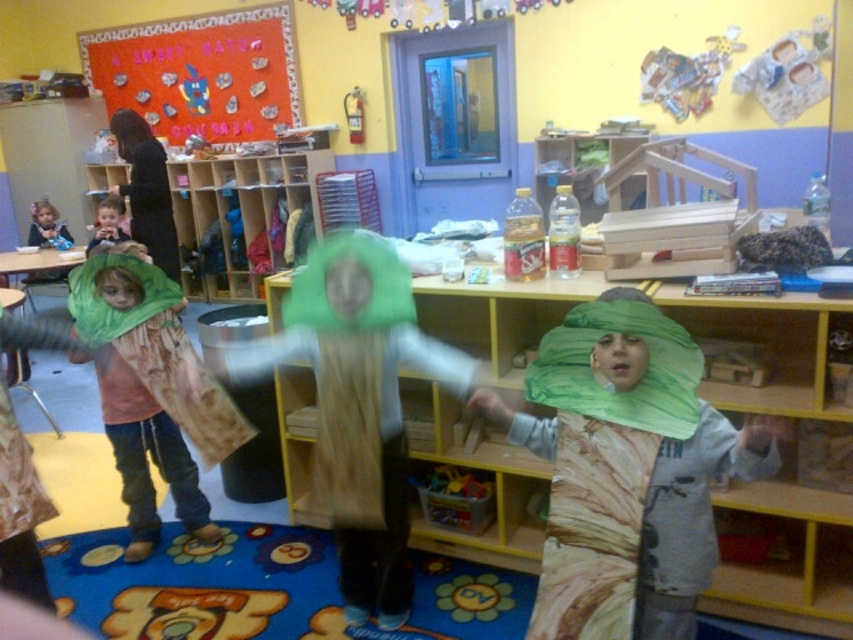
Which is more to the right, matte green leaf at center or green fabric headband at upper center?

From the viewer's perspective, matte green leaf at center appears more on the right side.

Which of these two, matte green leaf at center or green fabric headband at upper center, stands taller?

green fabric headband at upper center

Where is `matte green leaf at center`? Image resolution: width=853 pixels, height=640 pixels. matte green leaf at center is located at coordinates (625, 470).

Does matte green leaf at center have a larger size compared to green fabric tree at left?

Incorrect, matte green leaf at center is not larger than green fabric tree at left.

Who is lower down, matte green leaf at center or green fabric tree at left?

matte green leaf at center

Is point (596, 321) closer to camera compared to point (84, 280)?

Yes.

Image resolution: width=853 pixels, height=640 pixels. Identify the location of matte green leaf at center. (625, 470).

Does matte green leaf at center appear on the left side of green fabric head at center?

Incorrect, matte green leaf at center is not on the left side of green fabric head at center.

Who is taller, matte green leaf at center or green fabric head at center?

With more height is green fabric head at center.

Which is behind, point (614, 435) or point (358, 314)?

Point (358, 314)

Locate an element on the screen. This screenshot has width=853, height=640. matte green leaf at center is located at coordinates (625, 470).